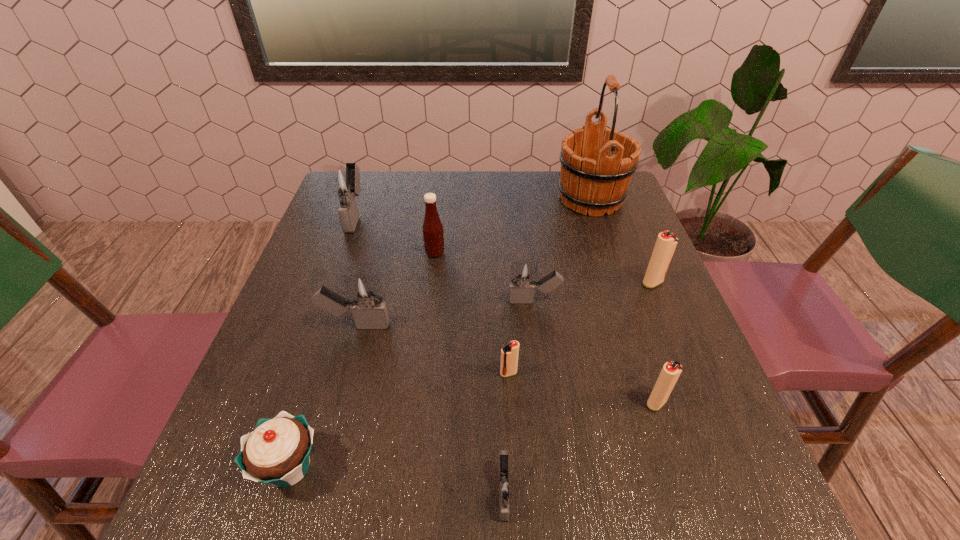
Identify the location of wood wine bucket. (593, 178).

Image resolution: width=960 pixels, height=540 pixels. I want to click on wine bucket, so click(x=593, y=178).

The height and width of the screenshot is (540, 960). What are the coordinates of `the biggest gray igniter` in the screenshot? It's located at (342, 181).

Identify the location of the tallest igniter. The image size is (960, 540). (342, 181).

In order to click on Tabasco sauce in this screenshot , I will do `click(433, 235)`.

You are a GUI agent. You are given a task and a screenshot of the screen. Output one action in this format:
    pyautogui.click(x=<x>, y=<y>)
    Task: Click on the eighth nearest object
    This screenshot has height=540, width=960.
    Given the screenshot: What is the action you would take?
    pyautogui.click(x=433, y=235)

Locate an element on the screen. the rightmost igniter is located at coordinates (666, 242).

This screenshot has height=540, width=960. What are the coordinates of `the seventh nearest object` in the screenshot? It's located at click(666, 242).

The height and width of the screenshot is (540, 960). Find the location of `the fifth nearest object`. the fifth nearest object is located at coordinates (365, 299).

What are the coordinates of `the third farthest gray igniter` in the screenshot? It's located at (365, 299).